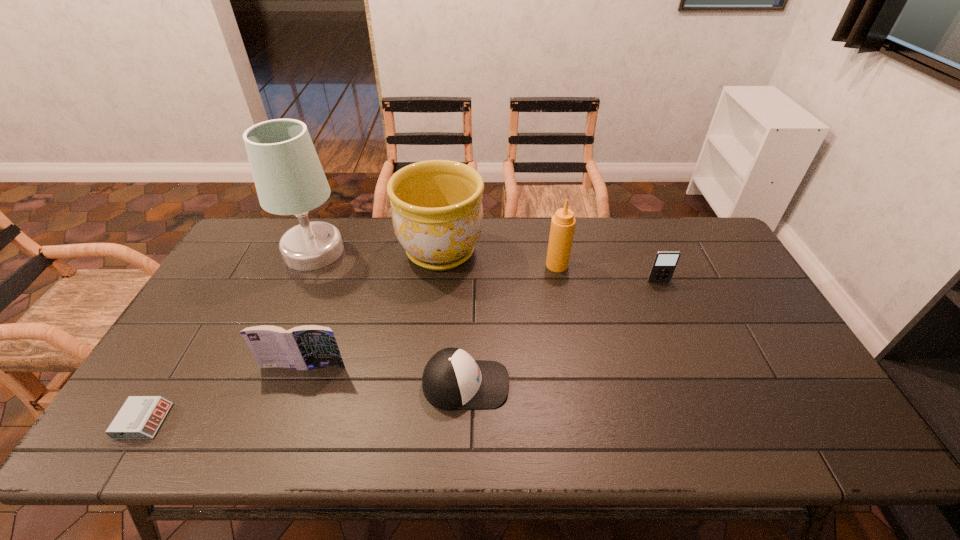
Locate an element on the screen. The image size is (960, 540). free space that satisfies the following two spatial constraints: 1. on the front side of the second object from right to left; 2. on the front panel of the cap is located at coordinates (580, 384).

This screenshot has width=960, height=540. I want to click on free space that satisfies the following two spatial constraints: 1. on the front-facing side of the iPod; 2. on the front panel of the cap, so click(703, 384).

Find the location of a particular element. blank area in the image that satisfies the following two spatial constraints: 1. on the back side of the condiment; 2. on the left side of the leftmost object is located at coordinates (238, 265).